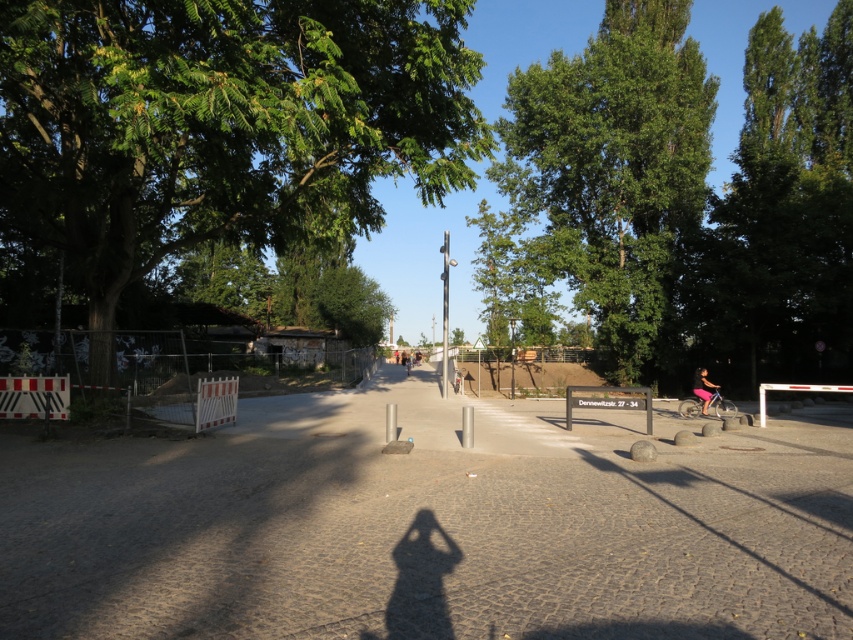
You are standing at the point marked as point [236,577]. You want to walk to the bicycle that is 5.29 meters away. What is the shortest path you can take to reach the bicycle without crossing the metal bollards and the low barrier with red and white stripes?

The shortest path would be to walk along the paved pathway towards the central point where the bicycle is located, staying within the pathway boundaries marked by the metal bollards and the low barrier with red and white stripes, as they are 5.29 meters apart.